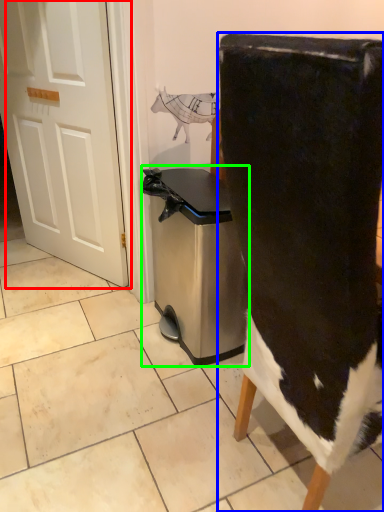
Question: Based on their relative distances, which object is farther from door (highlighted by a red box)? Choose from chair (highlighted by a blue box) and dish washer (highlighted by a green box).

Choices:
 (A) chair
 (B) dish washer

Answer: (A)